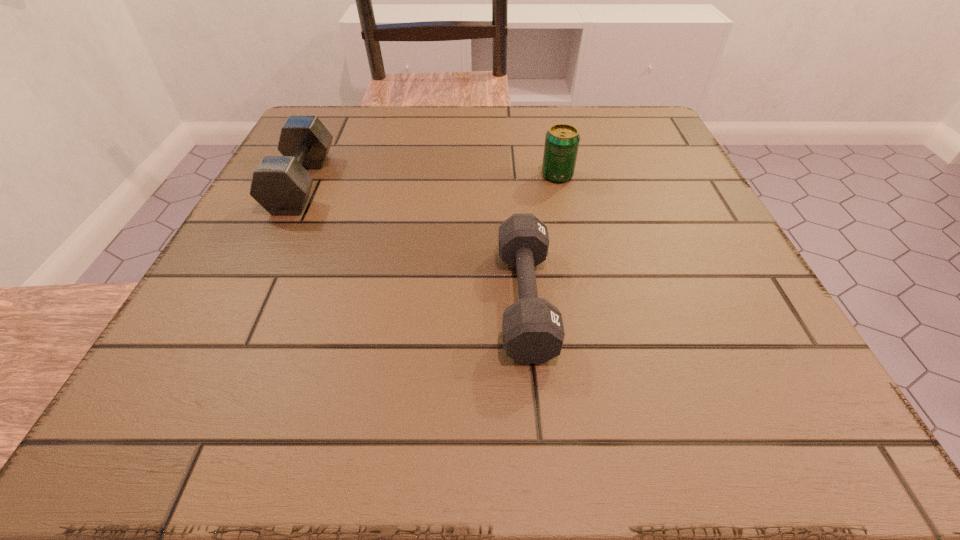
Locate an element on the screen. The height and width of the screenshot is (540, 960). beer can is located at coordinates (562, 141).

Locate an element on the screen. This screenshot has height=540, width=960. the taller dumbbell is located at coordinates (280, 184).

What are the coordinates of `the farther dumbbell` in the screenshot? It's located at (280, 184).

Locate an element on the screen. The height and width of the screenshot is (540, 960). the right dumbbell is located at coordinates (532, 328).

At what (x,y) coordinates should I click in order to perform the action: click on the shortest object. Please return your answer as a coordinate pair (x, y). Looking at the image, I should click on (532, 328).

The height and width of the screenshot is (540, 960). What are the coordinates of `free space located 0.350m on the left of the beer can` in the screenshot? It's located at (371, 176).

At what (x,y) coordinates should I click in order to perform the action: click on vacant area situated 0.140m on the back of the farther dumbbell. Please return your answer as a coordinate pair (x, y). This screenshot has height=540, width=960. Looking at the image, I should click on (330, 125).

Identify the location of free region located on the right of the nearest object. (689, 300).

Locate an element on the screen. object present at the far edge is located at coordinates (280, 184).

Find the location of a particular element. Image resolution: width=960 pixels, height=540 pixels. object located in the left edge section of the desktop is located at coordinates (280, 184).